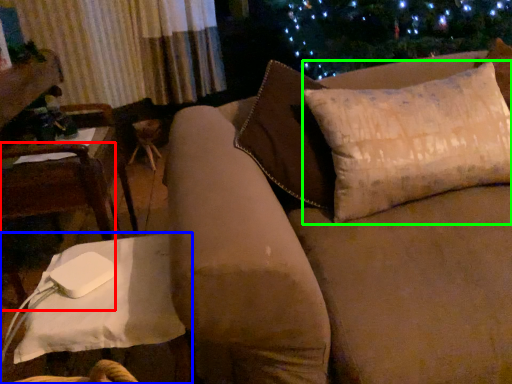
Question: Considering the real-world distances, which object is farthest from chair (highlighted by a red box)? table (highlighted by a blue box) or pillow (highlighted by a green box)?

Choices:
 (A) table
 (B) pillow

Answer: (B)